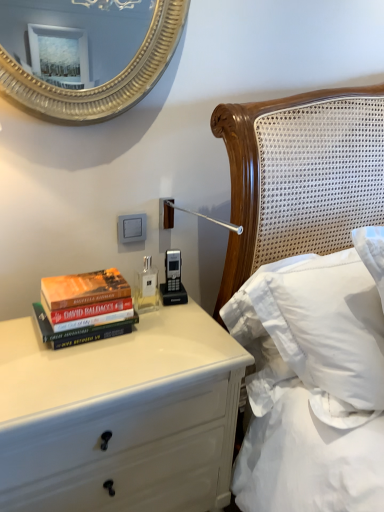
The width and height of the screenshot is (384, 512). Describe the element at coordinates (84, 308) in the screenshot. I see `hardcover books at left` at that location.

Measure the distance between point (151, 308) and camera.

They are 4.00 feet apart.

Find the location of a particular element. The image size is (384, 512). hardcover books at left is located at coordinates (84, 308).

Is clear glass bottle at center positioned in front of white soft pillow at upper right?

No, clear glass bottle at center is behind white soft pillow at upper right.

Who is bigger, clear glass bottle at center or white soft pillow at upper right?

white soft pillow at upper right.

Can you tell me how much clear glass bottle at center and white soft pillow at upper right differ in facing direction?

The angular difference between clear glass bottle at center and white soft pillow at upper right is 1.16 degrees.

Is clear glass bottle at center positioned with its back to white soft pillow at upper right?

No, clear glass bottle at center's orientation is not away from white soft pillow at upper right.

Considering the sizes of white soft pillow at upper right and clear glass bottle at center in the image, is white soft pillow at upper right wider or thinner than clear glass bottle at center?

Considering their sizes, white soft pillow at upper right looks broader than clear glass bottle at center.

Which point is more forward, (222, 121) or (152, 272)?

The point (222, 121) is more forward.

Which is in front, white soft pillow at upper right or clear glass bottle at center?

white soft pillow at upper right is in front.

Is white soft pillow at upper right not close to clear glass bottle at center?

white soft pillow at upper right is actually quite close to clear glass bottle at center.

How much distance is there between hardcover books at left and clear glass bottle at center?

6.67 inches.

From the image's perspective, is hardcover books at left above or below clear glass bottle at center?

Clearly, from the image's perspective, hardcover books at left is below clear glass bottle at center.

From a real-world perspective, does hardcover books at left stand above clear glass bottle at center?

Yes.

Would you consider hardcover books at left to be distant from clear glass bottle at center?

They are positioned close to each other.

Can you confirm if clear glass bottle at center is positioned to the left of hardcover books at left?

No, clear glass bottle at center is not to the left of hardcover books at left.

Is clear glass bottle at center smaller than hardcover books at left?

Yes.

Identify the location of book that is in front of the clear glass bottle at center. This screenshot has height=512, width=384. (84, 308).

Is clear glass bottle at center wider than hardcover books at left?

No, clear glass bottle at center is not wider than hardcover books at left.

Considering the sizes of objects clear glass bottle at center and white glossy chest of drawers at lower left in the image provided, who is taller, clear glass bottle at center or white glossy chest of drawers at lower left?

Standing taller between the two is white glossy chest of drawers at lower left.

Between point (141, 285) and point (188, 413), which one is positioned behind?

The point (141, 285) is farther.

Which object is further away from the camera, clear glass bottle at center or white glossy chest of drawers at lower left?

clear glass bottle at center is more distant.

Based on the photo, is clear glass bottle at center not close to white glossy chest of drawers at lower left?

No, clear glass bottle at center is in close proximity to white glossy chest of drawers at lower left.

From the image's perspective, is white glossy chest of drawers at lower left above or below clear glass bottle at center?

From the image's perspective, white glossy chest of drawers at lower left appears below clear glass bottle at center.

Could you tell me if white glossy chest of drawers at lower left is turned towards clear glass bottle at center?

No, white glossy chest of drawers at lower left is not facing towards clear glass bottle at center.

Is white glossy chest of drawers at lower left far away from clear glass bottle at center?

No, white glossy chest of drawers at lower left is not far away from clear glass bottle at center.

Can you tell me how much white glossy chest of drawers at lower left and clear glass bottle at center differ in facing direction?

The angle between the facing direction of white glossy chest of drawers at lower left and the facing direction of clear glass bottle at center is 0.567 degrees.

Between white glossy chest of drawers at lower left and white soft pillow at upper right, which one has larger size?

white glossy chest of drawers at lower left is bigger.

Based on the photo, from the image's perspective, which object appears higher, white glossy chest of drawers at lower left or white soft pillow at upper right?

white soft pillow at upper right.

In order to click on the chest of drawers that is under the white soft pillow at upper right (from a real-world perspective) in this screenshot , I will do `click(120, 416)`.

Measure the distance between white glossy chest of drawers at lower left and white soft pillow at upper right.

They are 16.67 inches apart.

Where is `bed directly beneath the clear glass bottle at center (from a real-world perspective)`? This screenshot has height=512, width=384. bed directly beneath the clear glass bottle at center (from a real-world perspective) is located at coordinates (252, 176).

You are a GUI agent. You are given a task and a screenshot of the screen. Output one action in this format:
    pyautogui.click(x=<x>, y=<y>)
    Task: Click on the bottle above the white soft pillow at upper right (from a real-world perspective)
    The width and height of the screenshot is (384, 512).
    Given the screenshot: What is the action you would take?
    pyautogui.click(x=146, y=287)

Based on their spatial positions, is clear glass bottle at center or white glossy chest of drawers at lower left closer to white soft pillow at upper right?

The object closer to white soft pillow at upper right is clear glass bottle at center.

From the image, which object appears to be farther from white soft pillow at upper right, clear glass bottle at center or hardcover books at left?

hardcover books at left lies further to white soft pillow at upper right than the other object.

Which object lies further to the anchor point clear glass bottle at center, white glossy chest of drawers at lower left or white soft pillow at upper right?

The object further to clear glass bottle at center is white soft pillow at upper right.

Looking at the image, which one is located closer to white soft pillow at upper right, hardcover books at left or white glossy chest of drawers at lower left?

The object closer to white soft pillow at upper right is white glossy chest of drawers at lower left.

Estimate the real-world distances between objects in this image. Which object is further from hardcover books at left, white glossy chest of drawers at lower left or clear glass bottle at center?

white glossy chest of drawers at lower left.

Considering their positions, is white soft pillow at upper right positioned closer to hardcover books at left than white glossy chest of drawers at lower left?

white glossy chest of drawers at lower left.

When comparing their distances from clear glass bottle at center, does white soft pillow at upper right or white glossy chest of drawers at lower left seem further?

Among the two, white soft pillow at upper right is located further to clear glass bottle at center.

When comparing their distances from clear glass bottle at center, does white soft pillow at upper right or hardcover books at left seem closer?

Based on the image, hardcover books at left appears to be nearer to clear glass bottle at center.

At what (x,y) coordinates should I click in order to perform the action: click on bottle between white glossy chest of drawers at lower left and white soft pillow at upper right. Please return your answer as a coordinate pair (x, y). The image size is (384, 512). Looking at the image, I should click on (146, 287).

The image size is (384, 512). Find the location of `the chest of drawers situated between hardcover books at left and white soft pillow at upper right from left to right`. the chest of drawers situated between hardcover books at left and white soft pillow at upper right from left to right is located at coordinates (120, 416).

The height and width of the screenshot is (512, 384). Find the location of `bottle situated between hardcover books at left and white soft pillow at upper right from left to right`. bottle situated between hardcover books at left and white soft pillow at upper right from left to right is located at coordinates (146, 287).

This screenshot has height=512, width=384. What are the coordinates of `book between clear glass bottle at center and white glossy chest of drawers at lower left in the vertical direction` in the screenshot? It's located at (84, 308).